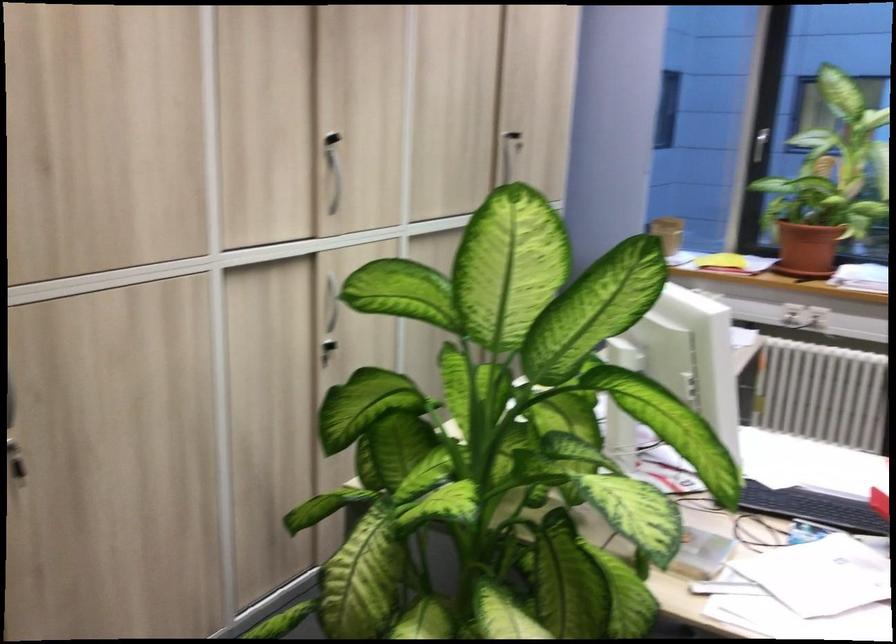
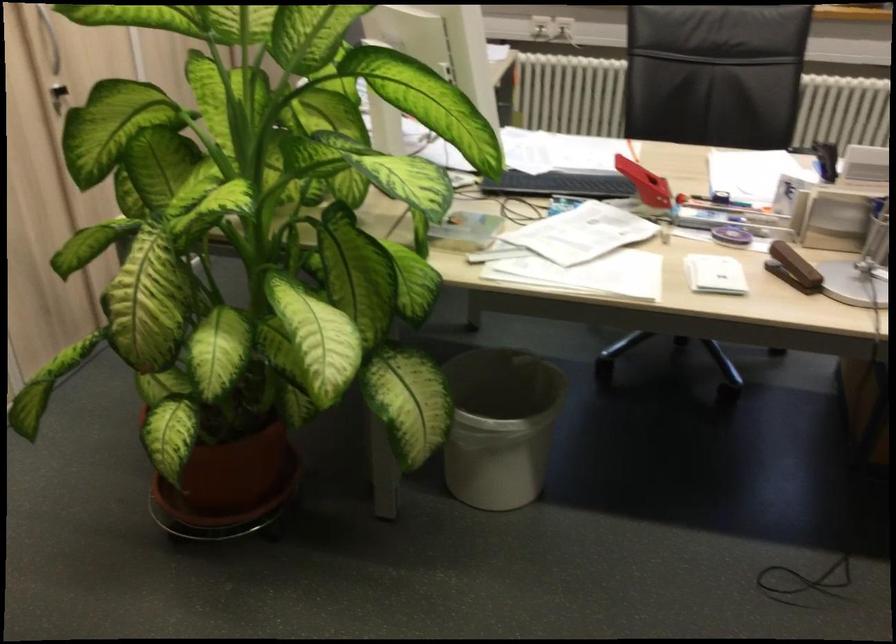
Question: The images are taken continuously from a first-person perspective. In which direction are you moving?

Choices:
 (A) Left
 (B) Right
 (C) Forward
 (D) Backward

Answer: (D)